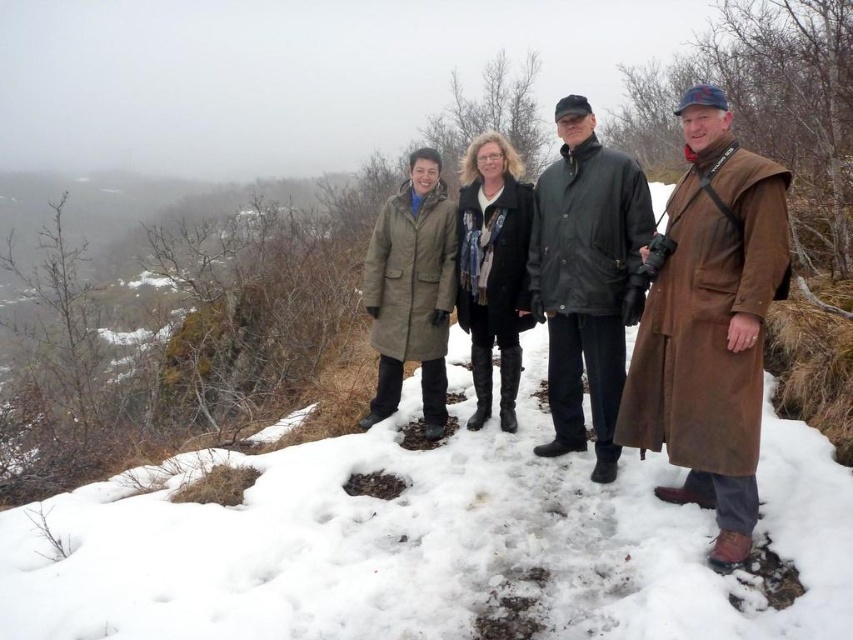
You are a photographer trying to capture a photo of the brown leather coat at right. You notice the white powdery snow at center might be distracting. Based on their positions, can you adjust your camera angle to hide the snow behind the coat?

The white powdery snow at center is located below the brown leather coat at right, so you can angle your camera upwards to hide the snow behind the coat.

You are a photographer trying to capture a group photo of the matte brown coat at center and the dark green leather jacket at center. Since you want to emphasize the size difference between them, which person should you position closer to the camera?

You should position the dark green leather jacket at center closer to the camera because the matte brown coat at center is larger in size and will appear bigger even when farther away.

You are a photographer trying to capture a photo of the matte brown coat at center and the brown leather coat at right. Based on their positions, which coat should you focus on first to ensure both are in frame?

The matte brown coat at center is below the brown leather coat at right, so you should focus on the brown leather coat at right first to ensure both are in frame.